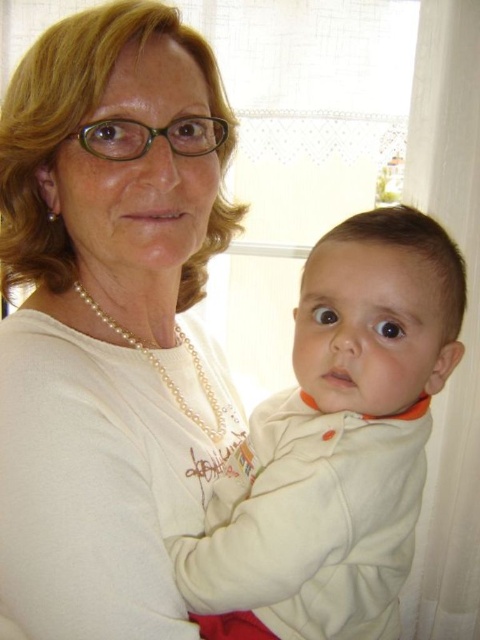
Question: In this image, where is white fleece baby at center located relative to pearl necklace at upper center?

Choices:
 (A) below
 (B) above

Answer: (A)

Question: Can you confirm if white fleece baby at center is bigger than pearl necklace at upper center?

Choices:
 (A) yes
 (B) no

Answer: (A)

Question: Which point is closer to the camera taking this photo?

Choices:
 (A) (182, 588)
 (B) (197, 520)
 (C) (121, 337)

Answer: (A)

Question: Does white fleece baby at center appear on the left side of pearl necklace at upper center?

Choices:
 (A) yes
 (B) no

Answer: (B)

Question: Among these objects, which one is farthest from the camera?

Choices:
 (A) white fleece baby at center
 (B) pearl necklace at center

Answer: (A)

Question: Which of the following is the farthest from the observer?

Choices:
 (A) pearl necklace at upper center
 (B) pearl necklace at center

Answer: (A)